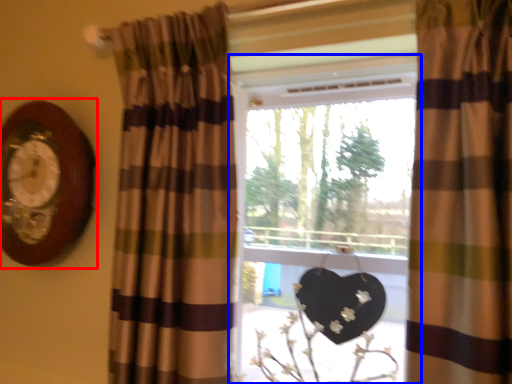
Question: Which point is further to the camera, clock (highlighted by a red box) or window (highlighted by a blue box)?

Choices:
 (A) clock
 (B) window

Answer: (A)